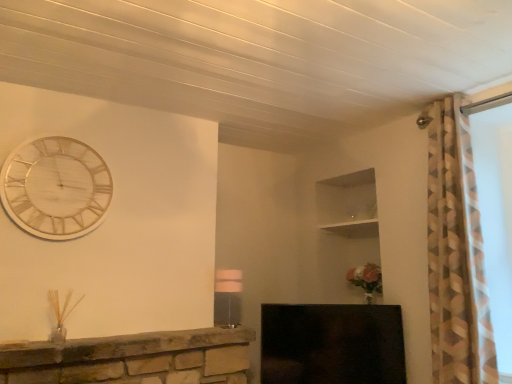
Question: Is matte white lampshade at center to the right of wooden/textured clock at upper left from the viewer's perspective?

Choices:
 (A) yes
 (B) no

Answer: (A)

Question: Can you confirm if matte white lampshade at center is taller than wooden/textured clock at upper left?

Choices:
 (A) no
 (B) yes

Answer: (A)

Question: Can you confirm if matte white lampshade at center is smaller than wooden/textured clock at upper left?

Choices:
 (A) yes
 (B) no

Answer: (A)

Question: From a real-world perspective, is matte white lampshade at center beneath wooden/textured clock at upper left?

Choices:
 (A) no
 (B) yes

Answer: (B)

Question: Is matte white lampshade at center outside wooden/textured clock at upper left?

Choices:
 (A) no
 (B) yes

Answer: (B)

Question: Relative to matte white lampshade at center, is black glossy fireplace at lower center in front or behind?

Choices:
 (A) front
 (B) behind

Answer: (B)

Question: Is black glossy fireplace at lower center spatially inside matte white lampshade at center, or outside of it?

Choices:
 (A) inside
 (B) outside

Answer: (B)

Question: From their relative heights in the image, would you say black glossy fireplace at lower center is taller or shorter than matte white lampshade at center?

Choices:
 (A) tall
 (B) short

Answer: (A)

Question: In the image, is black glossy fireplace at lower center on the left side or the right side of matte white lampshade at center?

Choices:
 (A) left
 (B) right

Answer: (B)

Question: In the image, is black glossy fireplace at lower center positioned in front of or behind wooden/textured clock at upper left?

Choices:
 (A) behind
 (B) front

Answer: (A)

Question: Is point (315, 360) positioned closer to the camera than point (48, 201)?

Choices:
 (A) closer
 (B) farther

Answer: (B)

Question: From a real-world perspective, relative to wooden/textured clock at upper left, is black glossy fireplace at lower center vertically above or below?

Choices:
 (A) below
 (B) above

Answer: (A)

Question: Considering the positions of black glossy fireplace at lower center and wooden/textured clock at upper left in the image, is black glossy fireplace at lower center taller or shorter than wooden/textured clock at upper left?

Choices:
 (A) tall
 (B) short

Answer: (B)

Question: Considering the positions of point (23, 170) and point (287, 326), is point (23, 170) closer or farther from the camera than point (287, 326)?

Choices:
 (A) closer
 (B) farther

Answer: (A)

Question: In the image, is wooden/textured clock at upper left positioned in front of or behind black glossy fireplace at lower center?

Choices:
 (A) behind
 (B) front

Answer: (B)